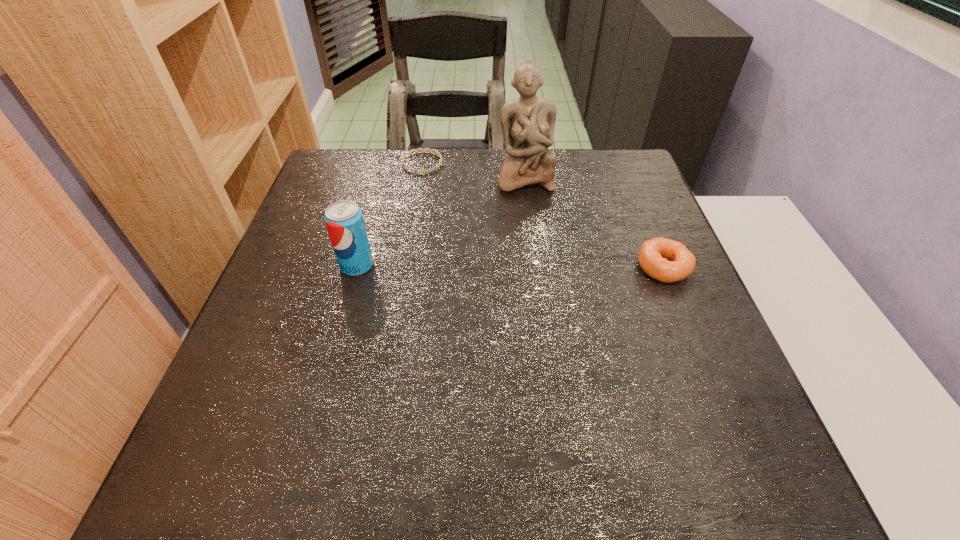
Where is `vacant space at the far edge of the desktop`? The width and height of the screenshot is (960, 540). vacant space at the far edge of the desktop is located at coordinates (478, 180).

Identify the location of vacant region at the near edge of the desktop. This screenshot has width=960, height=540. (375, 399).

Where is `free space at the left edge of the desktop`? Image resolution: width=960 pixels, height=540 pixels. free space at the left edge of the desktop is located at coordinates (323, 221).

In the image, there is a desktop. Identify the location of vacant area at the right edge. (604, 210).

The height and width of the screenshot is (540, 960). I want to click on free location at the near left corner of the desktop, so click(x=270, y=388).

This screenshot has width=960, height=540. I want to click on free spot at the near right corner of the desktop, so click(724, 390).

Where is `free space that is in between the shortest object and the second object from right to left`? free space that is in between the shortest object and the second object from right to left is located at coordinates (473, 171).

Where is `free space between the shortest object and the doughnut`? The height and width of the screenshot is (540, 960). free space between the shortest object and the doughnut is located at coordinates (543, 215).

Where is `free space that is in between the third shortest object and the figurine`? This screenshot has width=960, height=540. free space that is in between the third shortest object and the figurine is located at coordinates (441, 222).

Locate an element on the screen. vacant point located between the rightmost object and the second object from right to left is located at coordinates (594, 222).